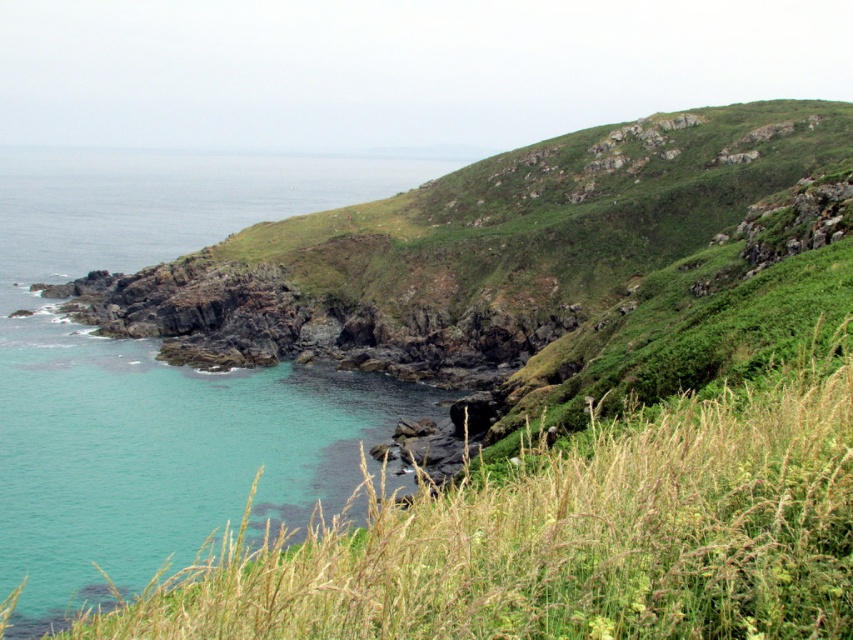
Question: Among these objects, which one is farthest from the camera?

Choices:
 (A) turquoise water at left
 (B) green grassy at lower left

Answer: (A)

Question: Among these objects, which one is farthest from the camera?

Choices:
 (A) turquoise water at left
 (B) green grassy at lower left

Answer: (A)

Question: Does green grassy at lower left have a lesser width compared to turquoise water at left?

Choices:
 (A) yes
 (B) no

Answer: (A)

Question: Can you confirm if green grassy at lower left is positioned above turquoise water at left?

Choices:
 (A) yes
 (B) no

Answer: (B)

Question: Which object is closer to the camera taking this photo?

Choices:
 (A) turquoise water at left
 (B) green grassy at lower left

Answer: (B)

Question: Does green grassy at lower left have a lesser width compared to turquoise water at left?

Choices:
 (A) no
 (B) yes

Answer: (B)